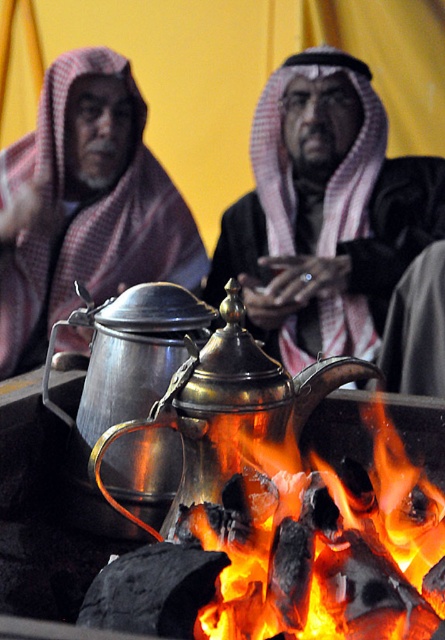
You are trying to decide whether the matte black robe at center can completely cover the shiny brass teapot at center. Based on their sizes, is this possible?

The matte black robe at center might be wider than shiny brass teapot at center, so it is possible that the robe could cover the teapot if its width is sufficient.

Consider the image. You are a guest in this scene and want to move closer to the charcoal fire at lower center without disturbing the matte black robe at center. Which direction should you move from your current position?

The charcoal fire at lower center is behind the matte black robe at center, so to move closer to the charcoal fire at lower center without disturbing the matte black robe at center, you should move backward from your current position.